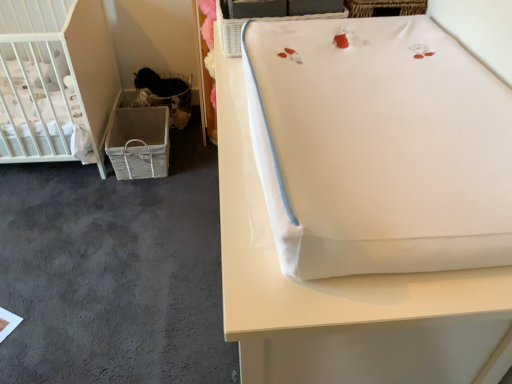
The width and height of the screenshot is (512, 384). I want to click on vacant space to the right of woven fabric basket at lower left, so click(x=194, y=170).